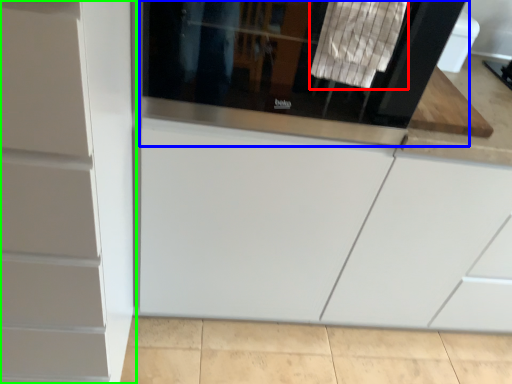
Question: Considering the real-world distances, which object is farthest from laundry (highlighted by a red box)? screen door (highlighted by a blue box) or cabinetry (highlighted by a green box)?

Choices:
 (A) screen door
 (B) cabinetry

Answer: (B)